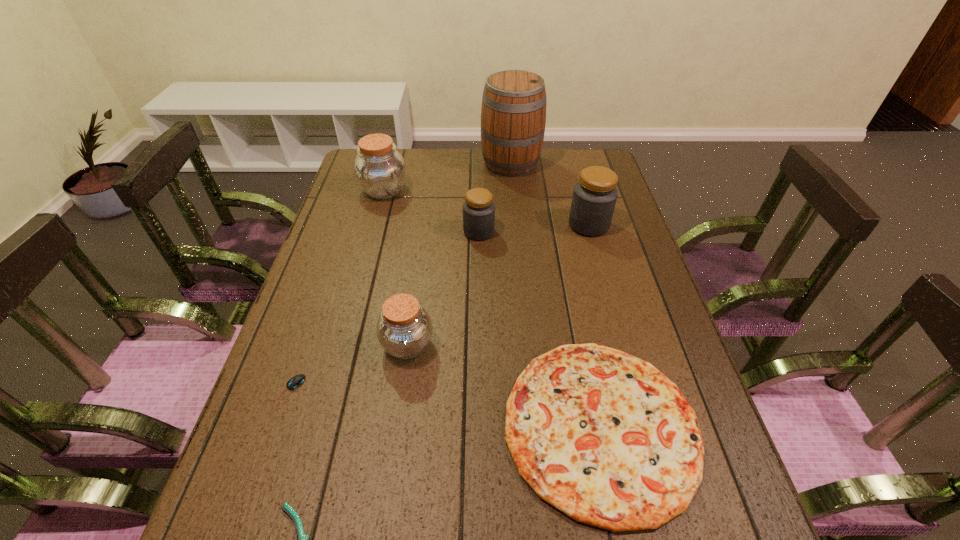
Locate an element on the screen. The width and height of the screenshot is (960, 540). mouse is located at coordinates (296, 381).

You are a GUI agent. You are given a task and a screenshot of the screen. Output one action in this format:
    pyautogui.click(x=<x>, y=<y>)
    Task: Click on the second shortest object
    
    Given the screenshot: What is the action you would take?
    pyautogui.click(x=296, y=381)

The width and height of the screenshot is (960, 540). What are the coordinates of `free location located on the right of the tallest object` in the screenshot? It's located at (595, 164).

Where is `free space located on the surface of the bigger gray jar near the warning symbol`? free space located on the surface of the bigger gray jar near the warning symbol is located at coordinates (526, 225).

The height and width of the screenshot is (540, 960). Find the location of `vacant space located 0.080m on the surface of the bigger gray jar near the warning symbol`. vacant space located 0.080m on the surface of the bigger gray jar near the warning symbol is located at coordinates (542, 225).

This screenshot has width=960, height=540. Find the location of `free space located on the surface of the bigger gray jar near the warning symbol`. free space located on the surface of the bigger gray jar near the warning symbol is located at coordinates (510, 225).

In order to click on blank space located on the back of the bigger brown jar in this screenshot , I will do `click(393, 158)`.

Locate an element on the screen. vacant space located on the surface of the smaller gray jar near the warning symbol is located at coordinates (613, 232).

Where is `free point located on the back of the smaller brown jar`? free point located on the back of the smaller brown jar is located at coordinates (423, 238).

Identify the location of blank space located 0.080m on the left of the sixth tallest object. (465, 426).